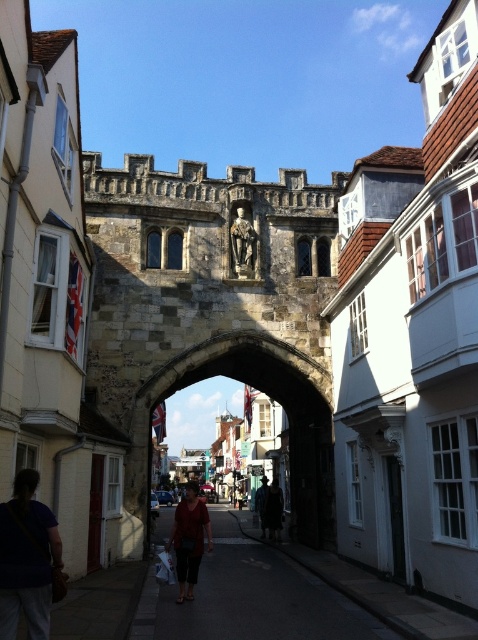
Is point (268, 586) positioned behind point (268, 490)?

No, (268, 586) is in front of (268, 490).

Looking at this image, which is below, dark gray asphalt at center or dark brown leather jacket at center?

dark gray asphalt at center

Who is more forward, (182, 605) or (273, 525)?

Positioned in front is point (182, 605).

Locate an element on the screen. This screenshot has width=478, height=640. dark gray asphalt at center is located at coordinates [x=250, y=596].

Does dark gray asphalt at center appear on the right side of dark blue shirt at lower left?

Yes, dark gray asphalt at center is to the right of dark blue shirt at lower left.

Which of these two, dark gray asphalt at center or dark blue shirt at lower left, stands shorter?

Standing shorter between the two is dark blue shirt at lower left.

Between point (292, 634) and point (14, 582), which one is positioned behind?

The point (292, 634) is behind.

Locate an element on the screen. dark gray asphalt at center is located at coordinates (250, 596).

Does dark brown leather jacket at center have a lesser height compared to dark blue jeans at center?

Yes.

Who is more forward, (275, 538) or (259, 492)?

Point (275, 538) is more forward.

Which is behind, point (281, 508) or point (261, 481)?

The point (261, 481) is behind.

Find the location of a particular element. dark brown leather jacket at center is located at coordinates (273, 509).